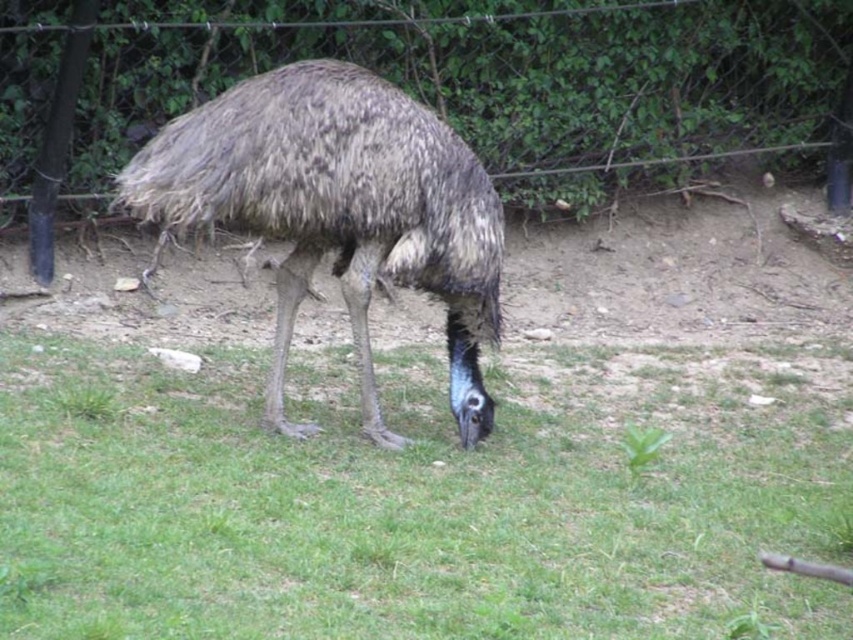
You are a photographer trying to capture the emu in the image. You notice the green grass at center and the wire mesh at upper center. Which object is positioned to the left of the other?

The green grass at center is to the left of the wire mesh at upper center.

You are a zookeeper who needs to feed an emu. You have a bucket of food placed on the green grass at center. The brown textured ostrich at center is nearby. Can the emu reach the food without stepping onto the grass?

The distance between the green grass at center and the brown textured ostrich at center is 38.44 inches. Since the emu can stretch its neck to reach the food, it can likely access the bucket without stepping onto the grass.

You are an animal keeper at a wildlife sanctuary. You need to check the enclosure for the emu. Based on the image, which object is smaller in size between the green grass at center and the wire mesh at upper center?

The green grass at center is smaller than the wire mesh at upper center.